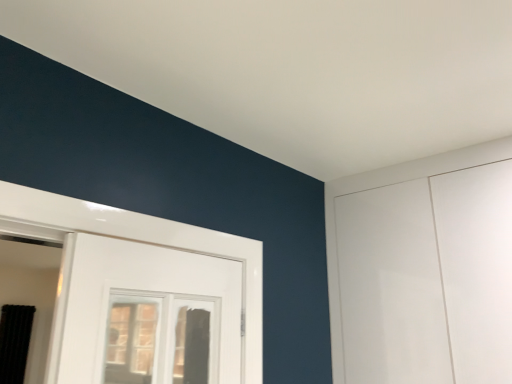
The image size is (512, 384). What do you see at coordinates (158, 338) in the screenshot?
I see `clear glass window at center` at bounding box center [158, 338].

Where is `clear glass window at center`? Image resolution: width=512 pixels, height=384 pixels. clear glass window at center is located at coordinates (x=158, y=338).

This screenshot has width=512, height=384. In order to click on black fabric curtain at left in this screenshot , I will do `click(14, 342)`.

The image size is (512, 384). Describe the element at coordinates (14, 342) in the screenshot. I see `black fabric curtain at left` at that location.

Locate an element on the screen. The height and width of the screenshot is (384, 512). clear glass window at center is located at coordinates (158, 338).

In the image, is black fabric curtain at left on the left side or the right side of clear glass window at center?

black fabric curtain at left is positioned on clear glass window at center's left side.

Relative to clear glass window at center, is black fabric curtain at left in front or behind?

black fabric curtain at left is positioned farther from the viewer than clear glass window at center.

Is point (5, 349) closer or farther from the camera than point (111, 300)?

Point (5, 349) appears to be farther away from the viewer than point (111, 300).

From the image's perspective, between black fabric curtain at left and clear glass window at center, which one is located above?

clear glass window at center, from the image's perspective.

From a real-world perspective, is black fabric curtain at left physically located above or below clear glass window at center?

black fabric curtain at left is below clear glass window at center.

Between black fabric curtain at left and clear glass window at center, which one has larger width?

With larger width is black fabric curtain at left.

Is black fabric curtain at left taller than clear glass window at center?

Indeed, black fabric curtain at left has a greater height compared to clear glass window at center.

Who is smaller, black fabric curtain at left or clear glass window at center?

black fabric curtain at left.

Is black fabric curtain at left inside or outside of clear glass window at center?

black fabric curtain at left is outside clear glass window at center.

Is black fabric curtain at left not close to clear glass window at center?

Absolutely, black fabric curtain at left is distant from clear glass window at center.

Is black fabric curtain at left facing away from clear glass window at center?

No, black fabric curtain at left is not facing the opposite direction of clear glass window at center.

Measure the distance between black fabric curtain at left and clear glass window at center.

black fabric curtain at left and clear glass window at center are 3.20 meters apart from each other.

In the image, there is a clear glass window at center. At what (x,y) coordinates should I click in order to perform the action: click on curtain below it (from the image's perspective). Please return your answer as a coordinate pair (x, y). This screenshot has height=384, width=512. Looking at the image, I should click on click(14, 342).

From the picture: Does clear glass window at center appear on the left side of black fabric curtain at left?

Incorrect, clear glass window at center is not on the left side of black fabric curtain at left.

Considering the positions of objects clear glass window at center and black fabric curtain at left in the image provided, who is behind, clear glass window at center or black fabric curtain at left?

black fabric curtain at left is further away from the camera.

Is point (135, 341) farther from camera compared to point (25, 337)?

No, (135, 341) is closer to viewer.

From the image's perspective, is clear glass window at center above or below black fabric curtain at left?

clear glass window at center is situated higher than black fabric curtain at left in the image.

From a real-world perspective, which is physically below, clear glass window at center or black fabric curtain at left?

black fabric curtain at left, from a real-world perspective.

Can you confirm if clear glass window at center is wider than black fabric curtain at left?

Incorrect, the width of clear glass window at center does not surpass that of black fabric curtain at left.

Can you confirm if clear glass window at center is taller than black fabric curtain at left?

In fact, clear glass window at center may be shorter than black fabric curtain at left.

Which of these two, clear glass window at center or black fabric curtain at left, is bigger?

clear glass window at center.

Would you say clear glass window at center is inside or outside black fabric curtain at left?

The correct answer is: outside.

Are clear glass window at center and black fabric curtain at left located far from each other?

That's right, there is a large distance between clear glass window at center and black fabric curtain at left.

Is clear glass window at center oriented away from black fabric curtain at left?

clear glass window at center is not turned away from black fabric curtain at left.

How distant is clear glass window at center from black fabric curtain at left?

clear glass window at center is 3.20 meters away from black fabric curtain at left.

The height and width of the screenshot is (384, 512). Identify the location of window that is on the right side of black fabric curtain at left. (158, 338).

You are a GUI agent. You are given a task and a screenshot of the screen. Output one action in this format:
    pyautogui.click(x=<x>, y=<y>)
    Task: Click on the window on the right of black fabric curtain at left
    Image resolution: width=512 pixels, height=384 pixels.
    Given the screenshot: What is the action you would take?
    pos(158,338)

Find the location of a particular element. curtain below the clear glass window at center (from a real-world perspective) is located at coordinates (14, 342).